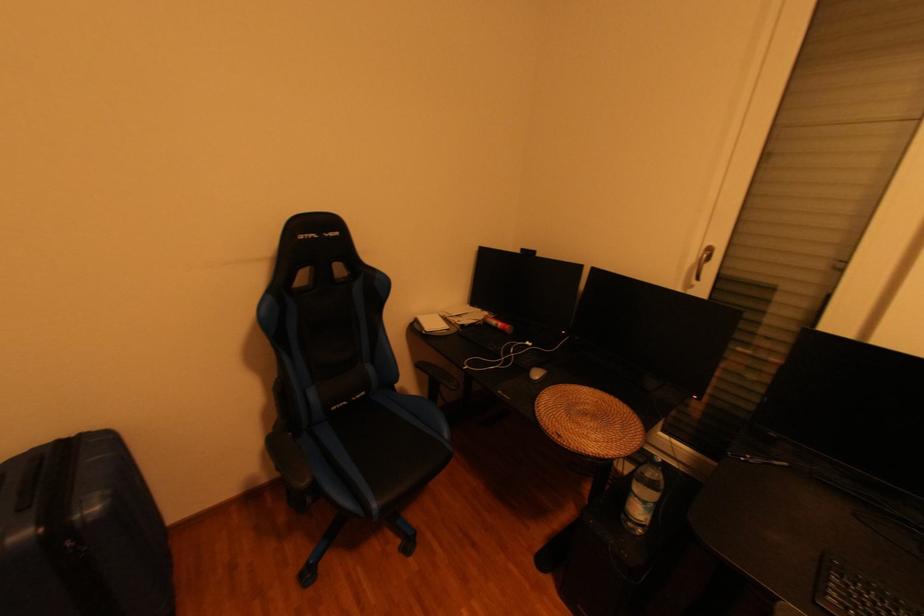
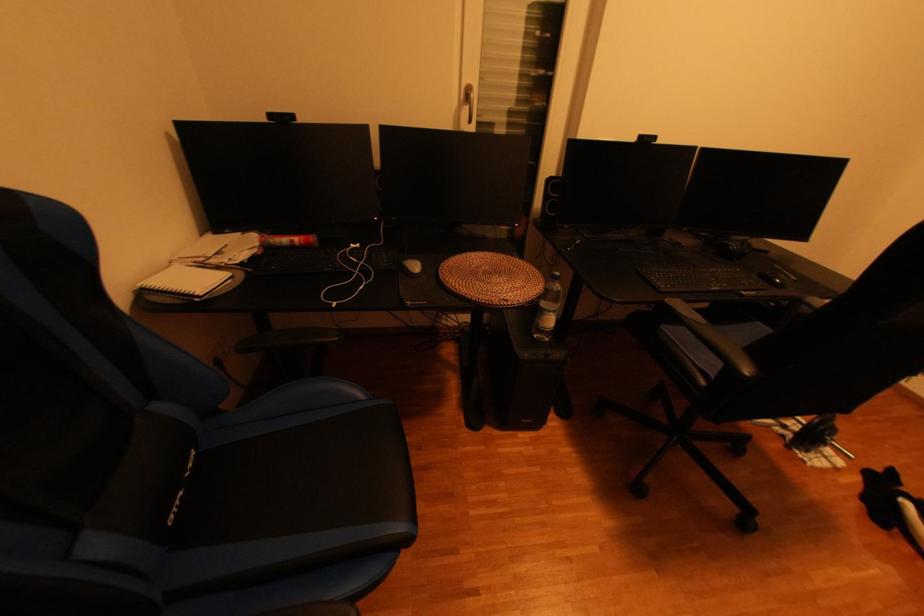
The point at (426, 326) is marked in the first image. Where is the corresponding point in the second image?

(164, 299)